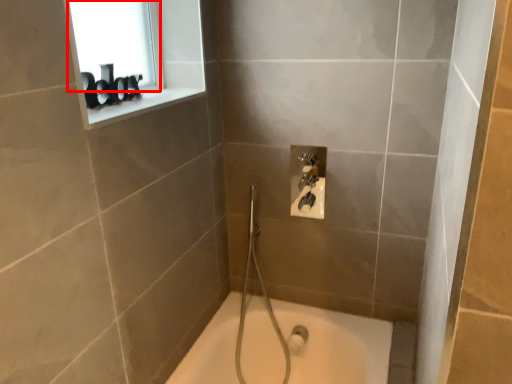
Question: From the image's perspective, what is the correct spatial positioning of window screen (annotated by the red box) in reference to window sill?

Choices:
 (A) below
 (B) above

Answer: (B)